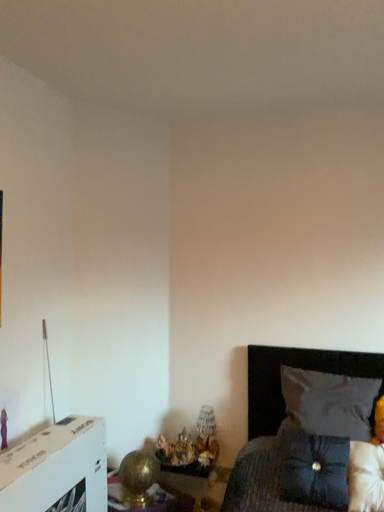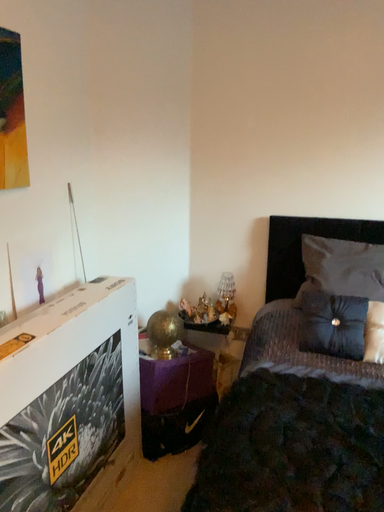
Question: Which way did the camera rotate in the video?

Choices:
 (A) rotated downward
 (B) rotated upward

Answer: (A)